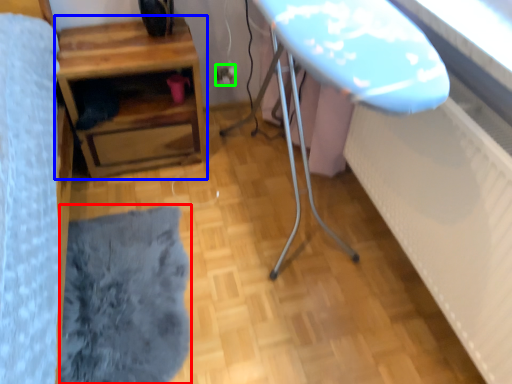
Question: Which object is the closest to the flat (highlighted by a red box)? Choose among these: table (highlighted by a blue box) or electric outlet (highlighted by a green box).

Choices:
 (A) table
 (B) electric outlet

Answer: (A)